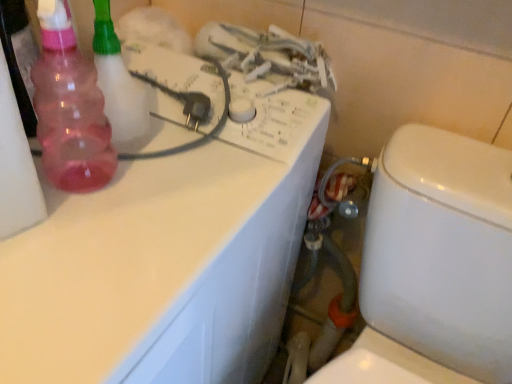
Question: Considering the relative sizes of pink translucent bottle at left and white glossy toilet at lower right in the image provided, is pink translucent bottle at left wider than white glossy toilet at lower right?

Choices:
 (A) yes
 (B) no

Answer: (B)

Question: Considering the relative sizes of pink translucent bottle at left and white glossy toilet at lower right in the image provided, is pink translucent bottle at left shorter than white glossy toilet at lower right?

Choices:
 (A) yes
 (B) no

Answer: (A)

Question: Is pink translucent bottle at left smaller than white glossy toilet at lower right?

Choices:
 (A) yes
 (B) no

Answer: (A)

Question: From the image's perspective, is pink translucent bottle at left on white glossy toilet at lower right?

Choices:
 (A) no
 (B) yes

Answer: (B)

Question: From the image's perspective, is pink translucent bottle at left located beneath white glossy toilet at lower right?

Choices:
 (A) yes
 (B) no

Answer: (B)

Question: Relative to pink translucent spray bottle at left, is white glossy counter top at upper left in front or behind?

Choices:
 (A) behind
 (B) front

Answer: (B)

Question: Which is correct: white glossy counter top at upper left is inside pink translucent spray bottle at left, or outside of it?

Choices:
 (A) inside
 (B) outside

Answer: (B)

Question: Considering the positions of point (176, 170) and point (104, 6), is point (176, 170) closer or farther from the camera than point (104, 6)?

Choices:
 (A) farther
 (B) closer

Answer: (A)

Question: Based on their sizes in the image, would you say white glossy counter top at upper left is bigger or smaller than pink translucent spray bottle at left?

Choices:
 (A) small
 (B) big

Answer: (B)

Question: Visually, is white glossy toilet at lower right positioned to the left or to the right of rubber hose at lower center?

Choices:
 (A) right
 (B) left

Answer: (A)

Question: From a real-world perspective, is white glossy toilet at lower right physically located above or below rubber hose at lower center?

Choices:
 (A) below
 (B) above

Answer: (A)

Question: Is white glossy toilet at lower right bigger or smaller than rubber hose at lower center?

Choices:
 (A) small
 (B) big

Answer: (B)

Question: Is white glossy toilet at lower right in front of or behind rubber hose at lower center in the image?

Choices:
 (A) behind
 (B) front

Answer: (B)

Question: Visually, is pink translucent bottle at left positioned to the left or to the right of rubber hose at lower center?

Choices:
 (A) right
 (B) left

Answer: (B)

Question: From the image's perspective, is pink translucent bottle at left located above or below rubber hose at lower center?

Choices:
 (A) above
 (B) below

Answer: (A)